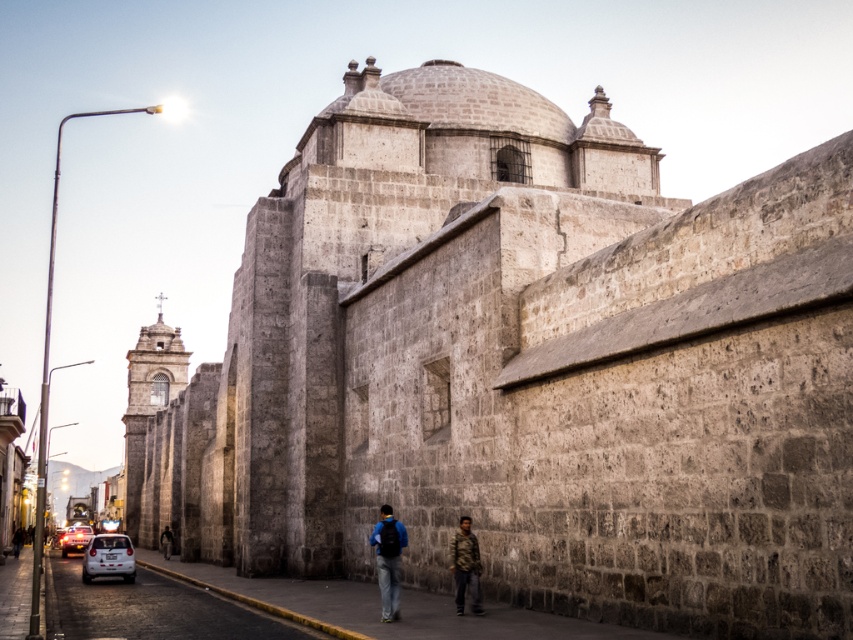
You are standing on the sidewalk next to the historic stone building and see both the white matte car at lower left and the white plastic car at lower left. Which car is nearer to you?

The white matte car at lower left is closer to the viewer than the white plastic car at lower left, so the white matte car at lower left is nearer to you.

You are standing on the sidewalk next to the historic stone building and see the white stone car at lower left and the blue fabric backpack at center. Which object is closer to you?

The white stone car at lower left is closer to you because it is in front of the blue fabric backpack at center.

You are standing at the point marked by coordinates point (466,518) and want to walk directly towards the historic stone building. The building is 100 meters away from you. If you walk at a constant speed of 1.5 meters per second, how long will it take you to reach the building?

The distance to the building is 100 meters, and walking at 1.5 mps would take approximately 66.67 seconds, so about 1 minute and 6.67 seconds.